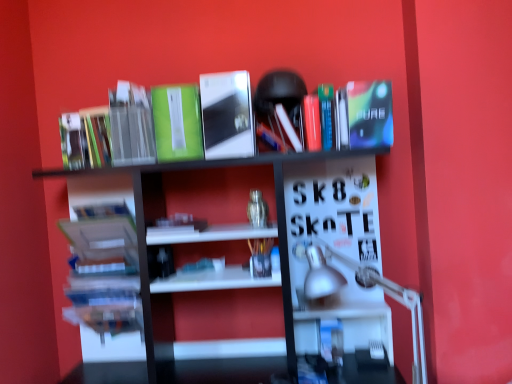
Identify the location of free point above white matte book at center, arranged as the 4th book when viewed from the left (from a real-world perspective). (179, 223).